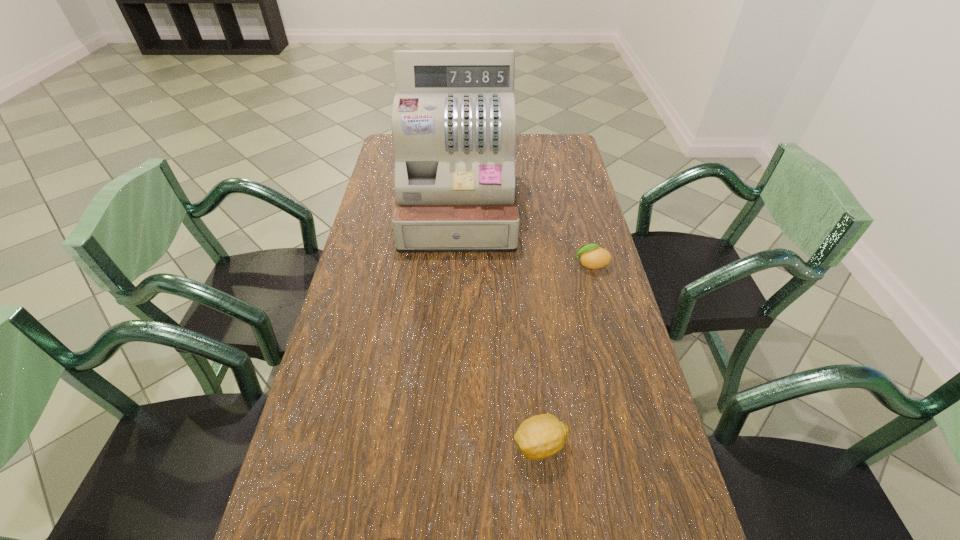
Locate an element on the screen. the farthest object is located at coordinates (453, 122).

The width and height of the screenshot is (960, 540). I want to click on cash register, so click(x=453, y=122).

Where is `the nearer lemon`? This screenshot has width=960, height=540. the nearer lemon is located at coordinates (541, 436).

Where is `the left lemon`? Image resolution: width=960 pixels, height=540 pixels. the left lemon is located at coordinates (541, 436).

Identify the location of the rightmost object. The height and width of the screenshot is (540, 960). (592, 256).

Where is `the second farthest object`? The width and height of the screenshot is (960, 540). the second farthest object is located at coordinates (592, 256).

In order to click on free space located on the operating side of the tallest object in this screenshot , I will do `click(455, 276)`.

Where is `blank space located 0.370m at the stem end of the nearer lemon`? This screenshot has height=540, width=960. blank space located 0.370m at the stem end of the nearer lemon is located at coordinates (338, 445).

Identify the location of free space located 0.280m at the stem end of the nearer lemon. The width and height of the screenshot is (960, 540). (380, 445).

Locate an element on the screen. vacant space located 0.060m at the stem end of the nearer lemon is located at coordinates (484, 445).